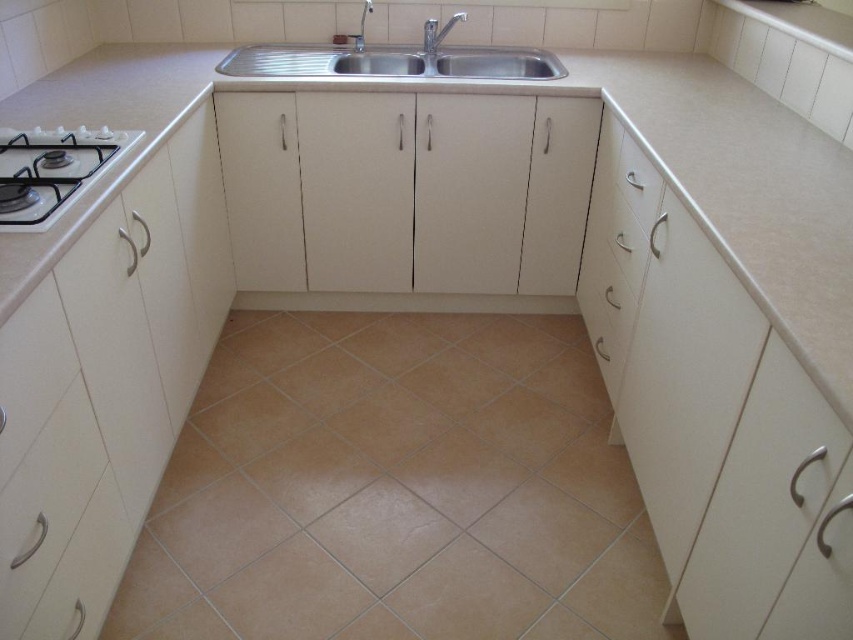
Can you confirm if white glossy drawer at center is thinner than silver metallic faucet at upper center?

Yes, white glossy drawer at center is thinner than silver metallic faucet at upper center.

From the picture: Is white glossy drawer at center shorter than silver metallic faucet at upper center?

Incorrect, white glossy drawer at center's height does not fall short of silver metallic faucet at upper center's.

Is point (630, 147) less distant than point (444, 33)?

That is True.

Where is `white glossy drawer at center`? The height and width of the screenshot is (640, 853). white glossy drawer at center is located at coordinates (636, 180).

Image resolution: width=853 pixels, height=640 pixels. I want to click on white glossy gas stove at left, so click(51, 170).

Which is in front, point (16, 193) or point (621, 195)?

Point (16, 193) is in front.

In order to click on white glossy gas stove at left in this screenshot , I will do `click(51, 170)`.

This screenshot has width=853, height=640. Identify the location of white glossy gas stove at left. (51, 170).

Does point (514, 77) lie in front of point (50, 214)?

No, it is not.

The height and width of the screenshot is (640, 853). Find the location of `stainless steel sink at center`. stainless steel sink at center is located at coordinates (393, 60).